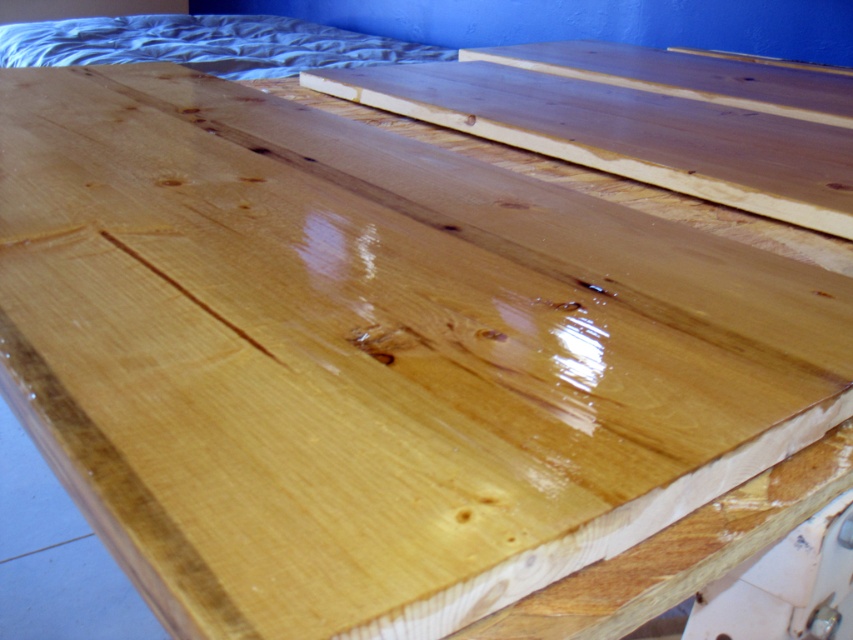
You are an interior designer planning to place a new lamp on the polished wooden surface. The lamp requires a specific coordinate point for installation. According to the scene, where should you place the lamp to align with the matte wood bed at upper center?

The matte wood bed at upper center is positioned at coordinates point (204, 44), so you should place the lamp at those coordinates to align with it.

Based on the photo, you are arranging furniture in a room with a vibrant blue wall. You have a matte wood bed at upper center and a satin wood plank at upper right. Which object is closer to the blue wall?

The satin wood plank at upper right is behind the matte wood bed at upper center, so the matte wood bed at upper center is closer to the blue wall.